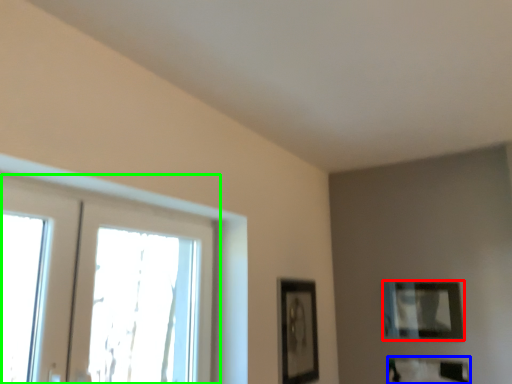
Question: Based on their relative distances, which object is farther from picture frame (highlighted by a red box)? Choose from picture frame (highlighted by a blue box) and window (highlighted by a green box).

Choices:
 (A) picture frame
 (B) window

Answer: (B)